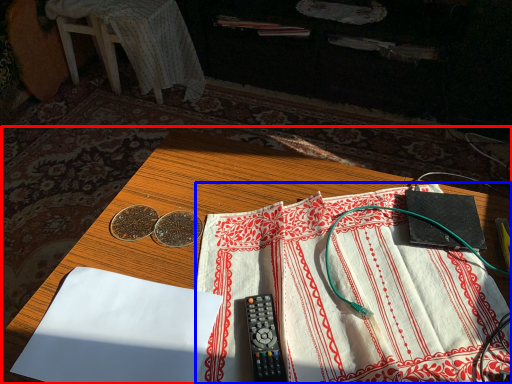
Question: Which point is further to the camera, table (highlighted by a red box) or sheet (highlighted by a blue box)?

Choices:
 (A) table
 (B) sheet

Answer: (B)